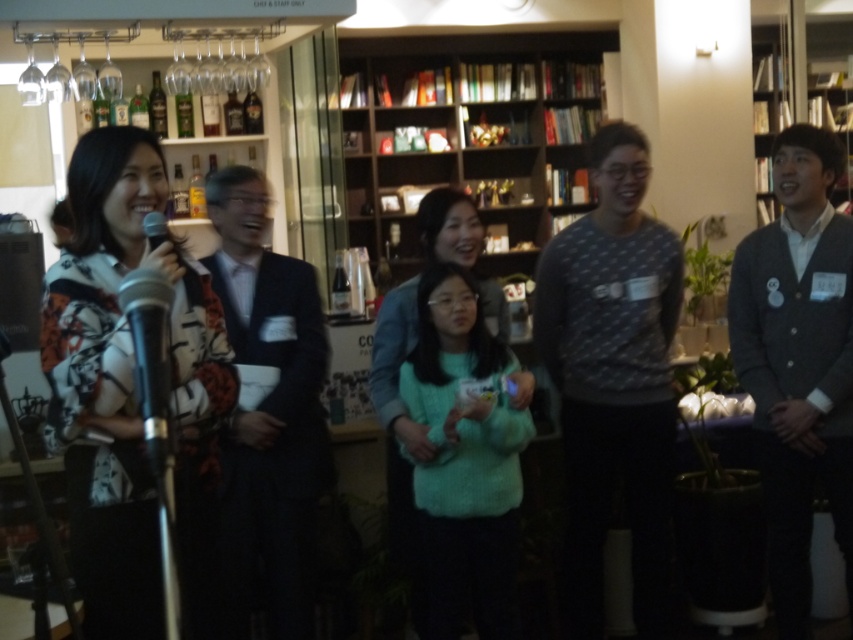
From the picture: You are organizing a small event and need to place a large decorative item that requires a sturdy support. You have the wooden bookshelf at center and the dark suit at center available. Which object would be more suitable for supporting the item based on their sizes?

The wooden bookshelf at center has a larger size compared to the dark suit at center, making it more suitable for supporting a large decorative item due to its sturdiness and size.

You are organizing a small event in a room with a wooden bookshelf at center and a dark gray suit at right. If you want to place a 1.8 meter tall poster on the wall behind the shorter object, which object should you choose?

The wooden bookshelf at center is shorter than the dark gray suit at right, so you should place the poster behind the wooden bookshelf at center.

Based on the photo, you are organizing a photo shoot and need to arrange two people wearing dark gray suit at right and dark suit at center in a row. Which person should be placed on the left side to ensure the row looks balanced?

The dark gray suit at right should be placed on the left side because its width is larger than the dark suit at center, creating a balanced arrangement.